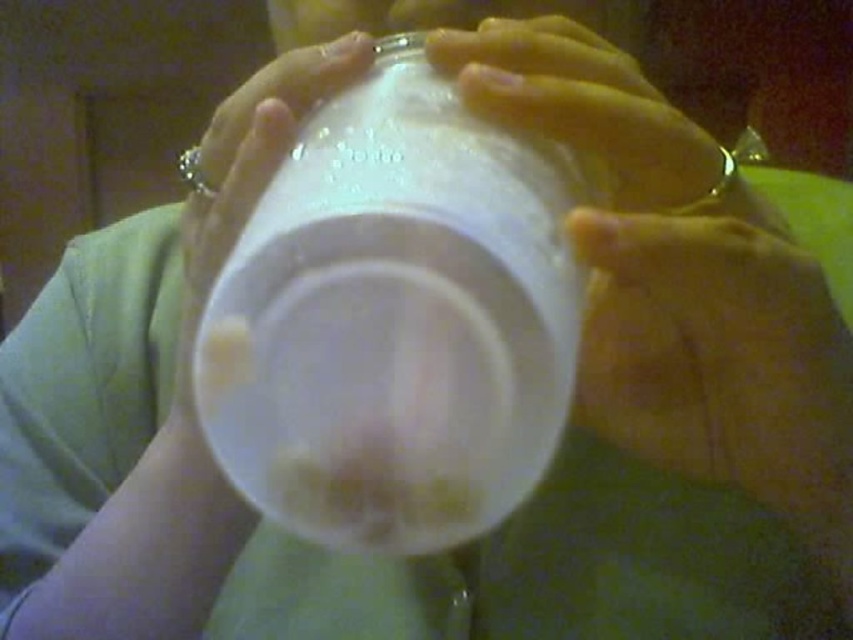
Question: Does translucent plastic cup at center have a greater width compared to yellow fabric at lower right?

Choices:
 (A) yes
 (B) no

Answer: (A)

Question: Which point is closer to the camera taking this photo?

Choices:
 (A) (566, 200)
 (B) (827, 472)

Answer: (A)

Question: Does translucent plastic cup at center appear under yellow fabric at lower right?

Choices:
 (A) no
 (B) yes

Answer: (A)

Question: Which of the following is the closest to the observer?

Choices:
 (A) (418, 243)
 (B) (602, 298)

Answer: (A)

Question: Observing the image, what is the correct spatial positioning of translucent plastic cup at center in reference to yellow fabric at lower right?

Choices:
 (A) below
 (B) above

Answer: (B)